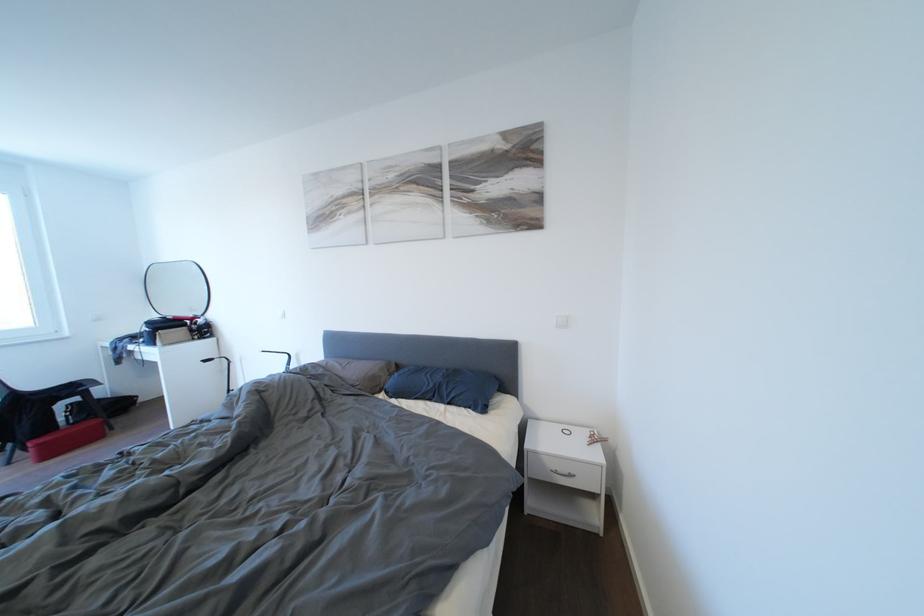
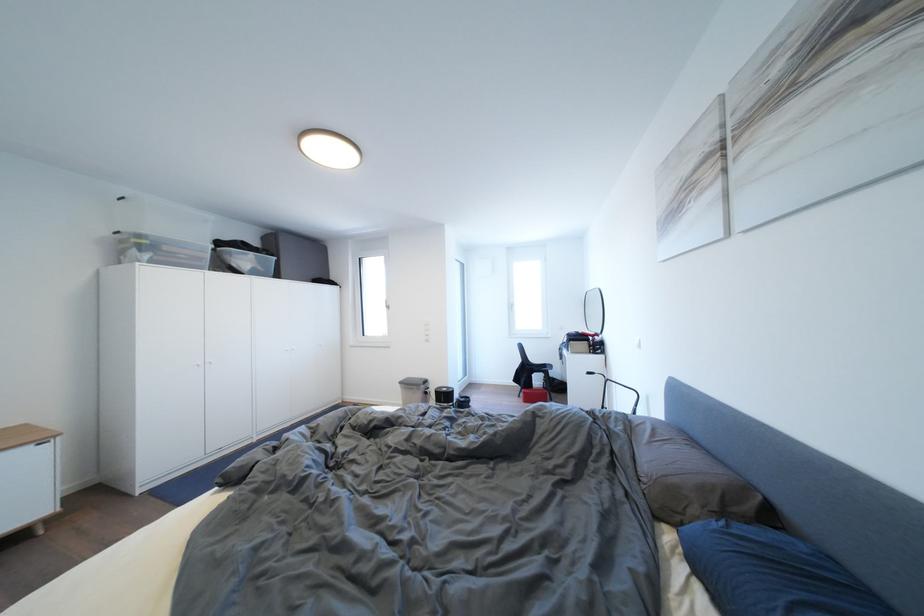
Question: The images are taken continuously from a first-person perspective. In which direction is your viewpoint rotating?

Choices:
 (A) Left
 (B) Right
 (C) Up
 (D) Down

Answer: (A)